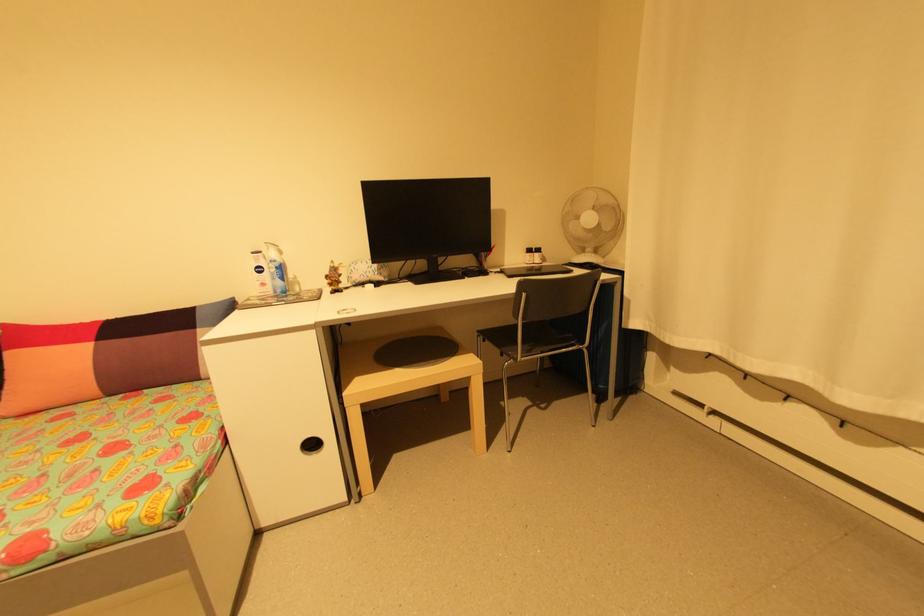
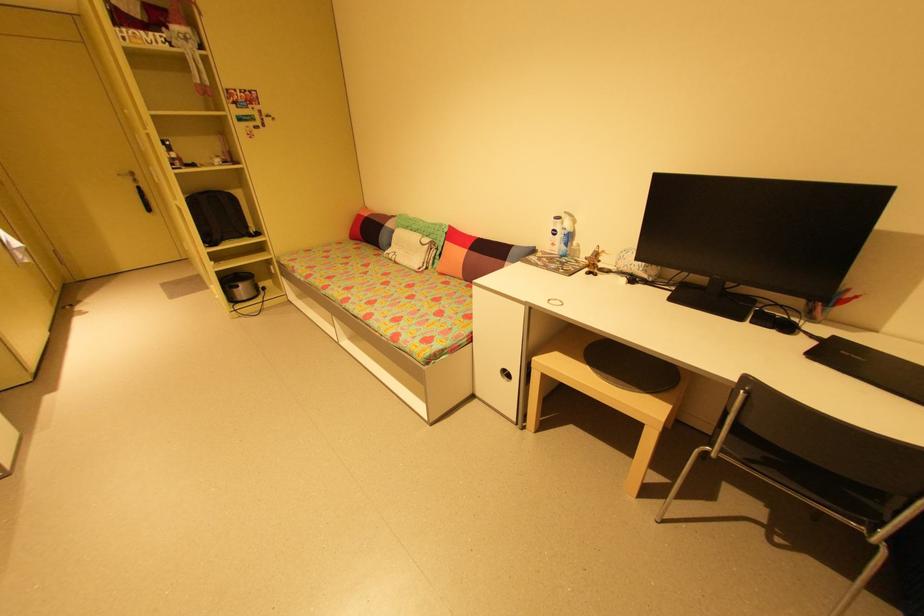
Where in the second image is the point corresponding to (317,446) from the first image?

(512, 375)